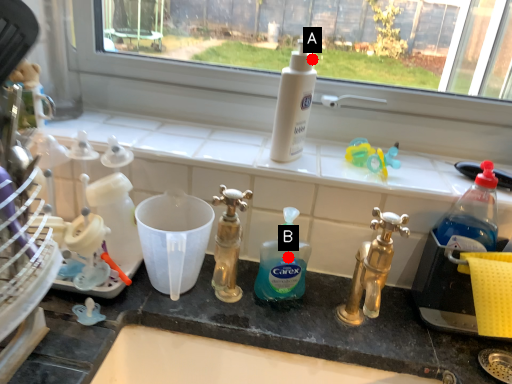
Question: Two points are circled on the image, labeled by A and B beside each circle. Which of the following is the closest to the observer?

Choices:
 (A) A is closer
 (B) B is closer

Answer: (B)